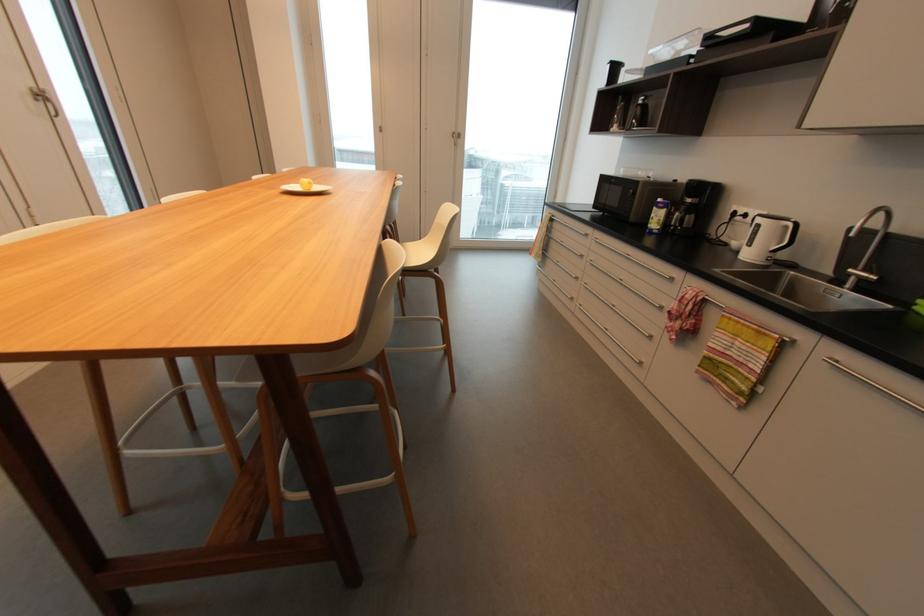
This screenshot has width=924, height=616. Describe the element at coordinates (860, 274) in the screenshot. I see `the metal faucet handle` at that location.